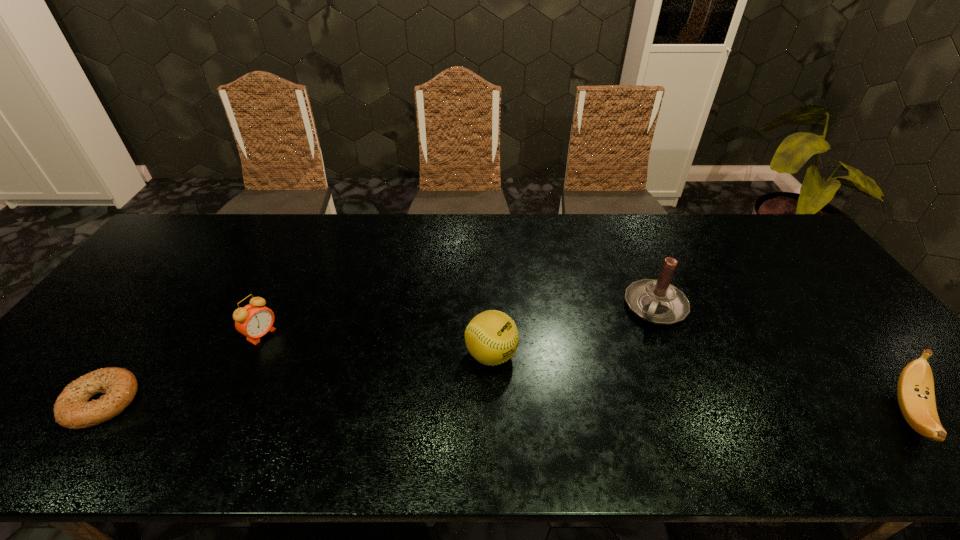
Identify the location of free space that is in between the softball and the leftmost object. This screenshot has height=540, width=960. (297, 378).

In order to click on vacant area that lies between the third object from left to right and the leftmost object in this screenshot , I will do `click(297, 378)`.

The image size is (960, 540). I want to click on object that is the second closest to the alarm clock, so click(491, 337).

Point out which object is positioned as the second nearest to the tallest object. Please provide its 2D coordinates. Your answer should be formatted as a tuple, i.e. [(x, y)], where the tuple contains the x and y coordinates of a point satisfying the conditions above.

[(915, 391)]

I want to click on vacant region that satisfies the following two spatial constraints: 1. on the back side of the leftmost object; 2. on the left side of the tallest object, so click(170, 307).